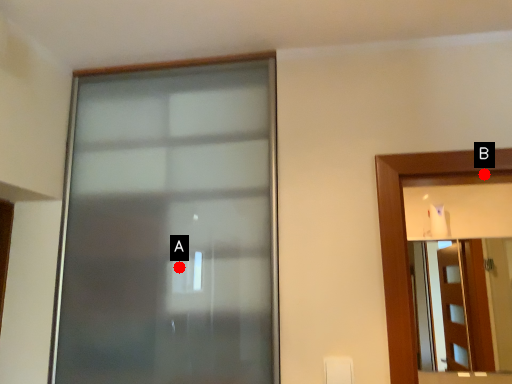
Question: Two points are circled on the image, labeled by A and B beside each circle. Which point is closer to the camera taking this photo?

Choices:
 (A) A is closer
 (B) B is closer

Answer: (B)